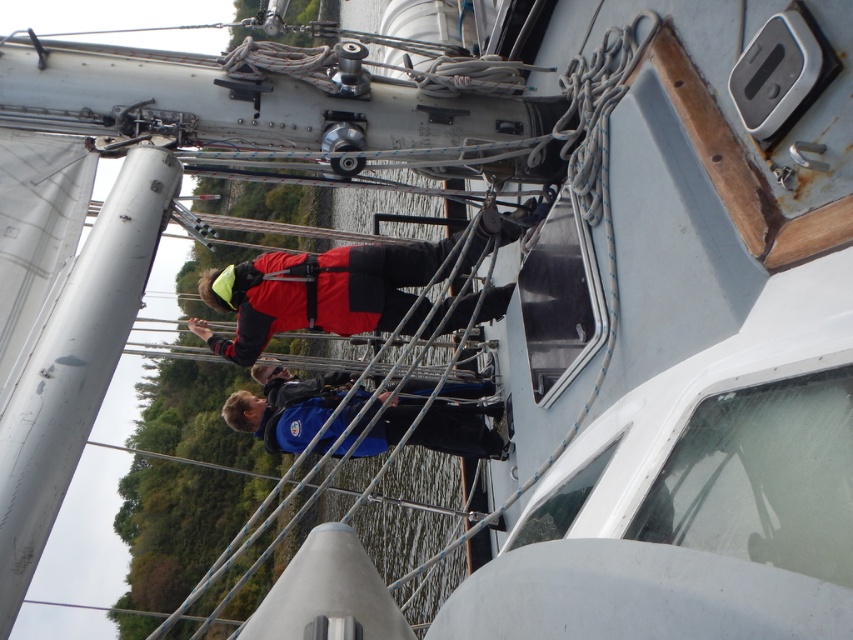
Is red matte life vest at center taller than blue fabric jacket at center?

Correct, red matte life vest at center is much taller as blue fabric jacket at center.

Is point (386, 244) positioned behind point (380, 435)?

Yes, point (386, 244) is farther from viewer.

Describe the element at coordinates (316, 292) in the screenshot. I see `red matte life vest at center` at that location.

Locate an element on the screen. This screenshot has width=853, height=640. red matte life vest at center is located at coordinates (316, 292).